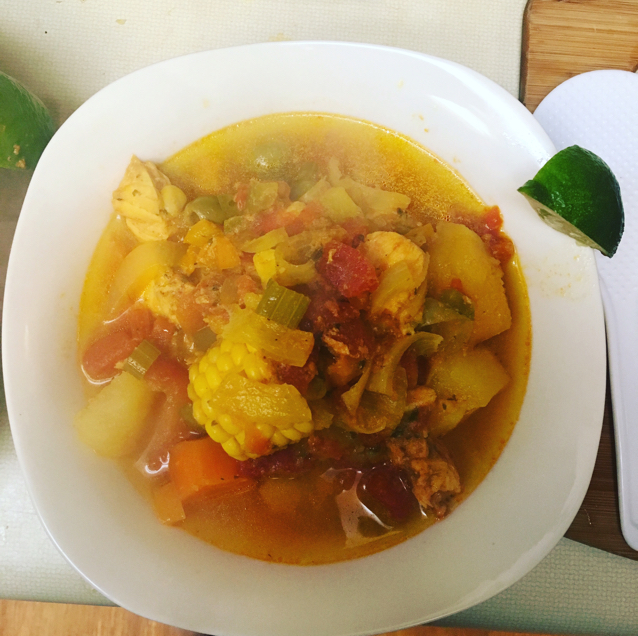
You are a GUI agent. You are given a task and a screenshot of the screen. Output one action in this format:
    pyautogui.click(x=<x>, y=<y>)
    Task: Click on the wooden table
    
    Given the screenshot: What is the action you would take?
    pyautogui.click(x=561, y=52)